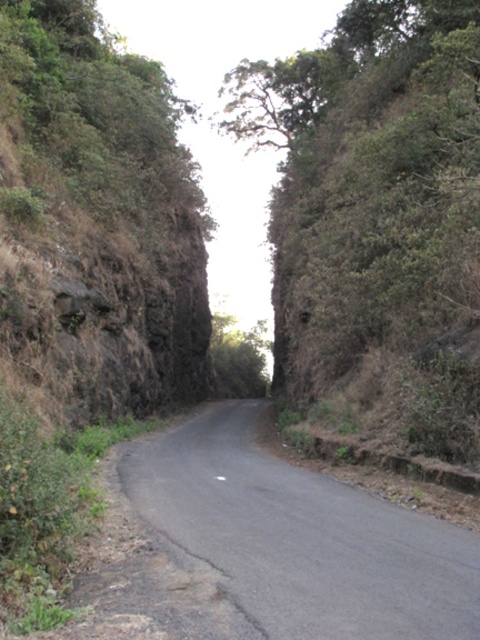
Question: Can you confirm if green leafy tree at center is positioned above black asphalt road at center?

Choices:
 (A) no
 (B) yes

Answer: (B)

Question: Where is green leafy tree at center located in relation to black asphalt road at center in the image?

Choices:
 (A) above
 (B) below

Answer: (A)

Question: Is green leafy tree at center positioned before black asphalt road at center?

Choices:
 (A) no
 (B) yes

Answer: (A)